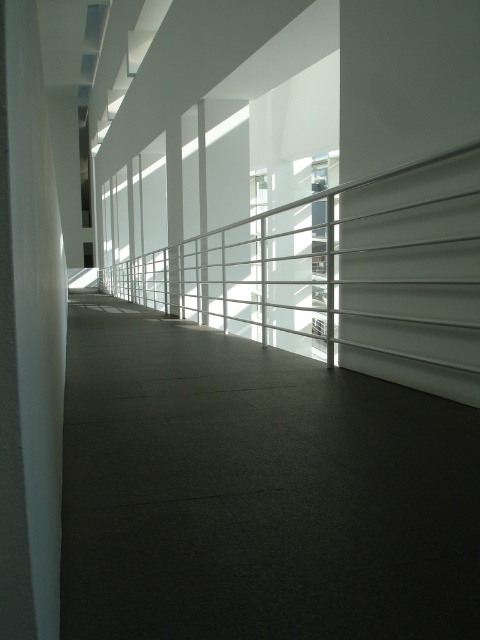
You are a maintenance worker tasked with inspecting the white metallic rail at center and the white smooth pillar at left. Which object is positioned higher in the scene?

The white metallic rail at center is located above the white smooth pillar at left, so it is positioned higher in the scene.

You are standing at the entrance of the corridor and want to locate the white metallic rail at center. According to the coordinates provided, where should you look in the image?

The white metallic rail at center is located at the coordinates point (336,268) in the image.

You are an architect designing a new corridor and want to ensure accessibility. You have a white metallic rail at center and a white smooth pillar at left in your design. Given their sizes, which one should you place closer to the walkway to avoid blocking pedestrian traffic?

The white metallic rail at center is bigger than the white smooth pillar at left, so you should place the white smooth pillar at left closer to the walkway to avoid blocking pedestrian traffic since it is smaller in size.